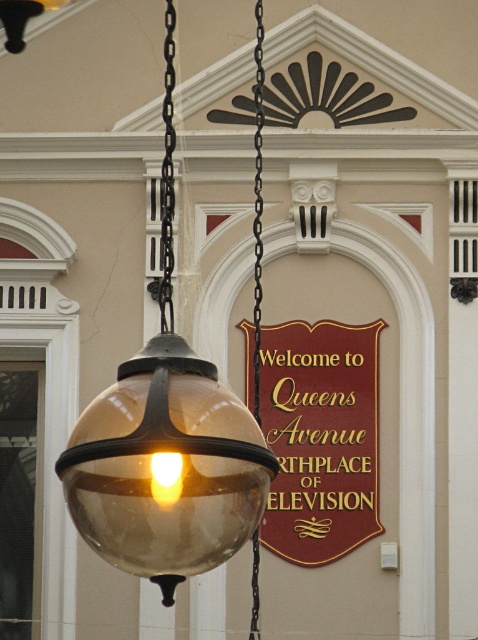
Question: Based on their relative distances, which object is nearer to the translucent glass globe at center?

Choices:
 (A) maroon polished wood sign at center
 (B) black metal chain at left
 (C) black metal chain at upper center

Answer: (B)

Question: Is translucent glass globe at center positioned in front of black metal chain at upper center?

Choices:
 (A) no
 (B) yes

Answer: (B)

Question: Which object is positioned farthest from the black metal chain at left?

Choices:
 (A) translucent glass globe at center
 (B) maroon polished wood sign at center

Answer: (B)

Question: Is black metal chain at left positioned at the back of black metal chain at upper center?

Choices:
 (A) no
 (B) yes

Answer: (A)

Question: From the image, what is the correct spatial relationship of black metal chain at left in relation to black metal chain at upper center?

Choices:
 (A) right
 (B) left

Answer: (A)

Question: Which of these objects is positioned closest to the black metal chain at upper center?

Choices:
 (A) translucent glass globe at center
 (B) maroon polished wood sign at center
 (C) black metal chain at left

Answer: (C)